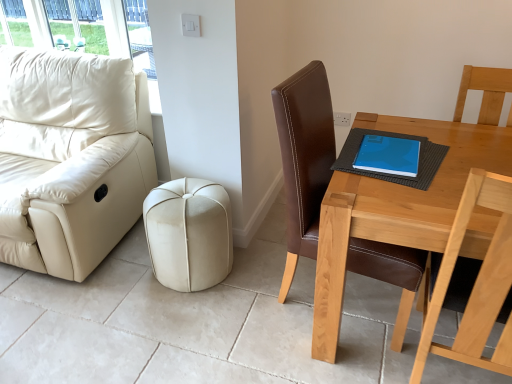
This screenshot has height=384, width=512. Identify the location of vacant point above blue matte book at upper right (from a real-world perspective). (389, 154).